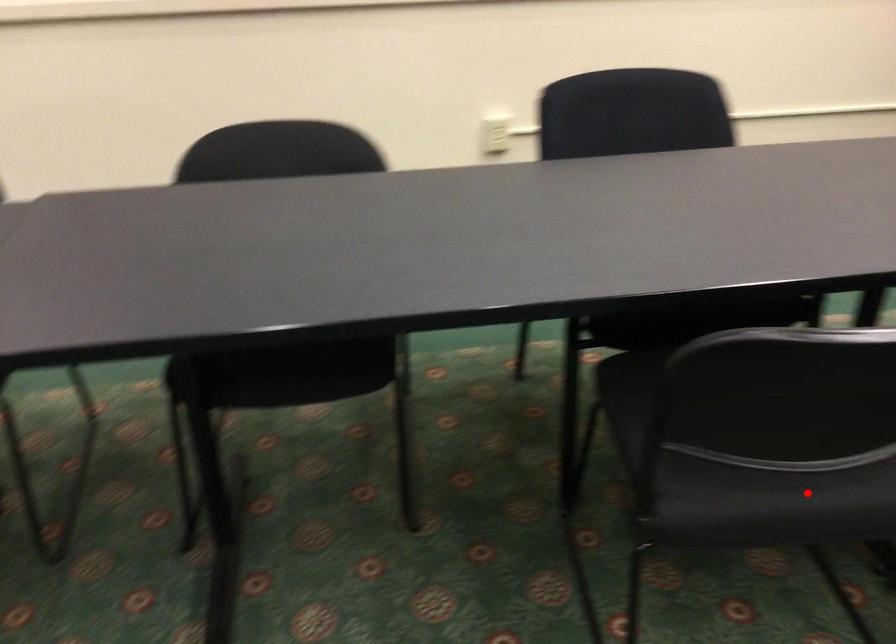
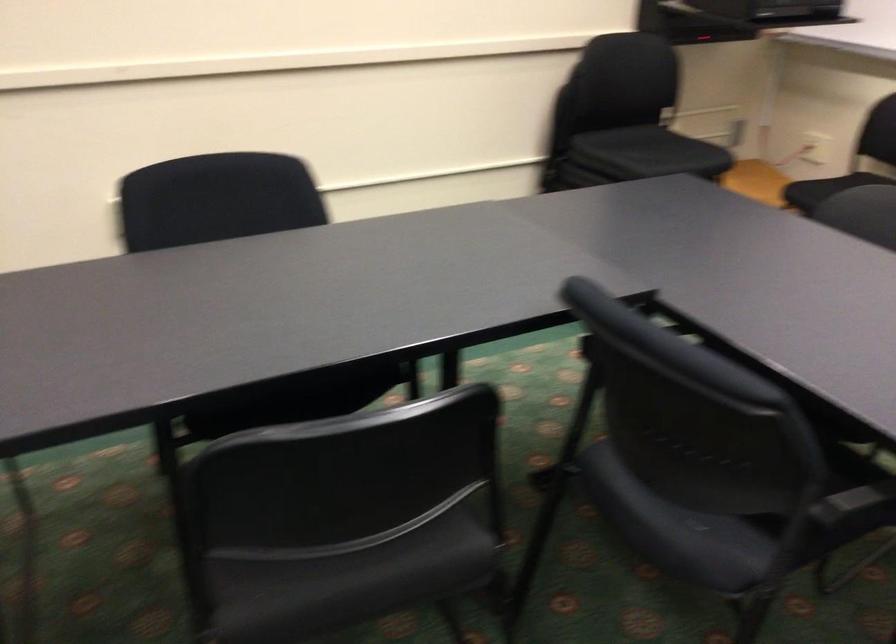
Find the pixel in the second image that matches the highlighted location in the first image.

(371, 569)